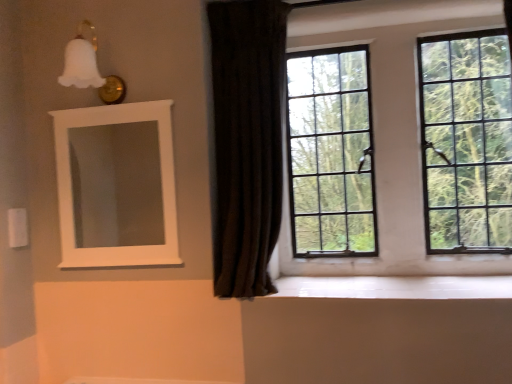
Question: Considering the relative sizes of white matte medicine cabinet at upper left and clear glass window at upper right in the image provided, is white matte medicine cabinet at upper left taller than clear glass window at upper right?

Choices:
 (A) yes
 (B) no

Answer: (B)

Question: Is white matte medicine cabinet at upper left next to clear glass window at upper right and touching it?

Choices:
 (A) no
 (B) yes

Answer: (A)

Question: Is white matte medicine cabinet at upper left further to camera compared to clear glass window at upper right?

Choices:
 (A) no
 (B) yes

Answer: (A)

Question: From the image's perspective, is white matte medicine cabinet at upper left beneath clear glass window at upper right?

Choices:
 (A) no
 (B) yes

Answer: (B)

Question: Can you confirm if white matte medicine cabinet at upper left is thinner than clear glass window at upper right?

Choices:
 (A) no
 (B) yes

Answer: (B)

Question: Can we say white matte medicine cabinet at upper left lies outside clear glass window at upper right?

Choices:
 (A) no
 (B) yes

Answer: (B)

Question: Is white matte medicine cabinet at upper left thinner than white glossy wood at lower center?

Choices:
 (A) no
 (B) yes

Answer: (B)

Question: From a real-world perspective, does white matte medicine cabinet at upper left stand above white glossy wood at lower center?

Choices:
 (A) yes
 (B) no

Answer: (A)

Question: Is white matte medicine cabinet at upper left not within white glossy wood at lower center?

Choices:
 (A) yes
 (B) no

Answer: (A)

Question: Does white matte medicine cabinet at upper left have a greater width compared to white glossy wood at lower center?

Choices:
 (A) yes
 (B) no

Answer: (B)

Question: From the image's perspective, would you say white matte medicine cabinet at upper left is positioned over white glossy wood at lower center?

Choices:
 (A) no
 (B) yes

Answer: (B)

Question: From a real-world perspective, is white matte medicine cabinet at upper left physically below white glossy wood at lower center?

Choices:
 (A) yes
 (B) no

Answer: (B)

Question: From the image's perspective, is white glossy wood at lower center located beneath dark velvet curtain at center?

Choices:
 (A) no
 (B) yes

Answer: (B)